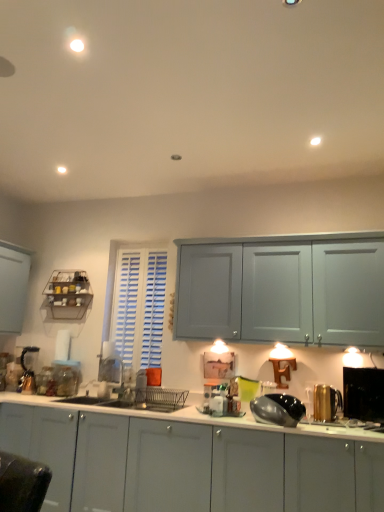
Question: From a real-world perspective, is shiny metallic kettle at center, marked as the fifth appliance in a back-to-front arrangement, under clear glass jar at lower left, marked as the second appliance in a left-to-right arrangement?

Choices:
 (A) no
 (B) yes

Answer: (B)

Question: Does shiny metallic kettle at center, the 3th appliance in the left-to-right sequence, have a greater height compared to clear glass jar at lower left, marked as the second appliance in a left-to-right arrangement?

Choices:
 (A) yes
 (B) no

Answer: (B)

Question: Is shiny metallic kettle at center, marked as the first appliance in a front-to-back arrangement, to the left of clear glass jar at lower left, which is counted as the 4th appliance, starting from the right, from the viewer's perspective?

Choices:
 (A) yes
 (B) no

Answer: (B)

Question: From the image's perspective, would you say shiny metallic kettle at center, marked as the fifth appliance in a back-to-front arrangement, is positioned over clear glass jar at lower left, which is counted as the 4th appliance, starting from the right?

Choices:
 (A) no
 (B) yes

Answer: (B)

Question: Are shiny metallic kettle at center, the 3th appliance in the left-to-right sequence, and clear glass jar at lower left, which is counted as the 4th appliance, starting from the right, making contact?

Choices:
 (A) yes
 (B) no

Answer: (B)

Question: Is shiny metallic kettle at center, the 3th appliance in the left-to-right sequence, not within clear glass jar at lower left, which is counted as the 4th appliance, starting from the right?

Choices:
 (A) no
 (B) yes

Answer: (B)

Question: Is the position of black glossy toaster at right, positioned as the 2th appliance in front-to-back order, more distant than that of metallic silver blender at left, the first appliance positioned from the back?

Choices:
 (A) no
 (B) yes

Answer: (A)

Question: Considering the relative sizes of black glossy toaster at right, marked as the fourth appliance in a back-to-front arrangement, and metallic silver blender at left, the first appliance positioned from the back, in the image provided, is black glossy toaster at right, marked as the fourth appliance in a back-to-front arrangement, shorter than metallic silver blender at left, the first appliance positioned from the back,?

Choices:
 (A) no
 (B) yes

Answer: (B)

Question: Can metallic silver blender at left, the first appliance positioned from the back, be found inside black glossy toaster at right, which is counted as the fifth appliance, starting from the left?

Choices:
 (A) no
 (B) yes

Answer: (A)

Question: Can you confirm if black glossy toaster at right, positioned as the 2th appliance in front-to-back order, is taller than metallic silver blender at left, the 5th appliance from the right?

Choices:
 (A) no
 (B) yes

Answer: (A)

Question: Is black glossy toaster at right, positioned as the 2th appliance in front-to-back order, next to metallic silver blender at left, the first appliance positioned from the back, and touching it?

Choices:
 (A) no
 (B) yes

Answer: (A)

Question: Is black glossy toaster at right, marked as the fourth appliance in a back-to-front arrangement, aimed at metallic silver blender at left, the 5th appliance from the right?

Choices:
 (A) yes
 (B) no

Answer: (B)

Question: From the image's perspective, is clear glass jar at lower left, marked as the second appliance in a left-to-right arrangement, beneath shiny metallic kettle at center, the 3th appliance in the right-to-left sequence?

Choices:
 (A) no
 (B) yes

Answer: (B)